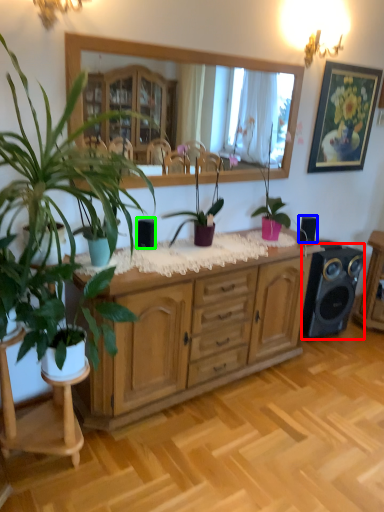
Question: Considering the real-world distances, which object is farthest from speaker (highlighted by a red box)? speaker (highlighted by a blue box) or speaker (highlighted by a green box)?

Choices:
 (A) speaker
 (B) speaker

Answer: (B)